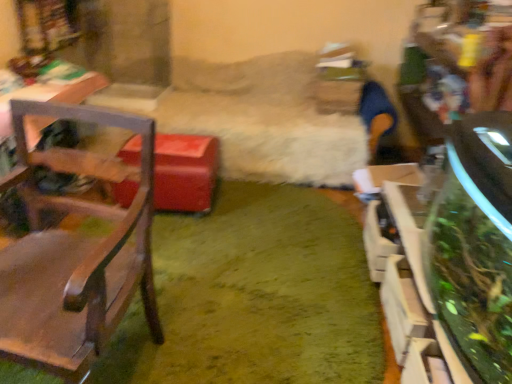
The height and width of the screenshot is (384, 512). What are the coordinates of `free space above green leafy plant at right (from a real-world perspective)` in the screenshot? It's located at (447, 225).